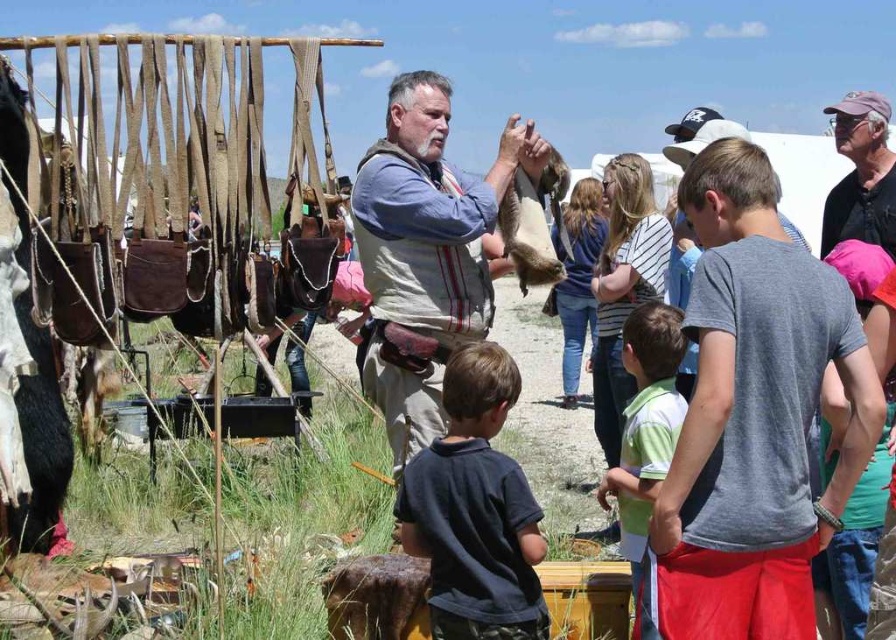
Question: Which point appears closest to the camera in this image?

Choices:
 (A) (759, 486)
 (B) (459, 508)

Answer: (A)

Question: Among these points, which one is nearest to the camera?

Choices:
 (A) (578, 301)
 (B) (441, 154)
 (C) (843, 552)
 (D) (552, 209)

Answer: (C)

Question: Can you confirm if dark blue cotton shirt at lower center is positioned to the left of dark gray shirt at right?

Choices:
 (A) yes
 (B) no

Answer: (A)

Question: Does gray cotton t-shirt at right have a larger size compared to light brown denim jeans at center?

Choices:
 (A) yes
 (B) no

Answer: (B)

Question: Does brown leather vest at center lie in front of light brown denim jeans at center?

Choices:
 (A) yes
 (B) no

Answer: (A)

Question: Which point appears closest to the camera in this image?

Choices:
 (A) (599, 180)
 (B) (721, 340)
 (C) (408, 240)

Answer: (B)